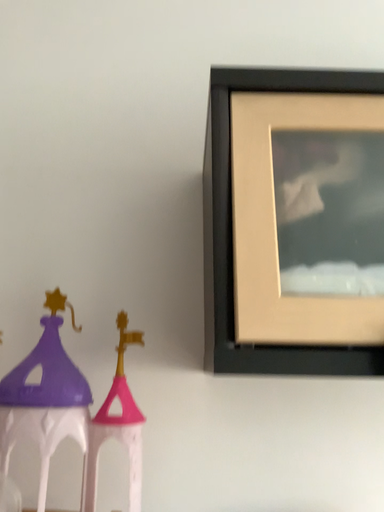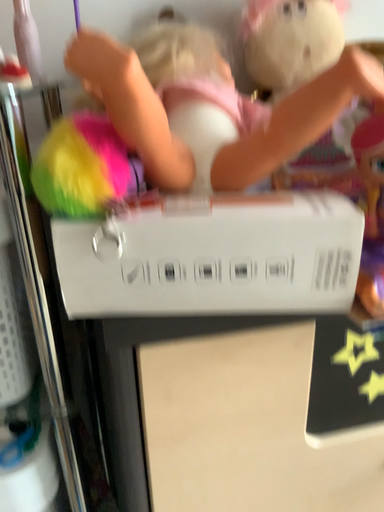
Question: How did the camera likely rotate when shooting the video?

Choices:
 (A) rotated upward
 (B) rotated downward

Answer: (B)